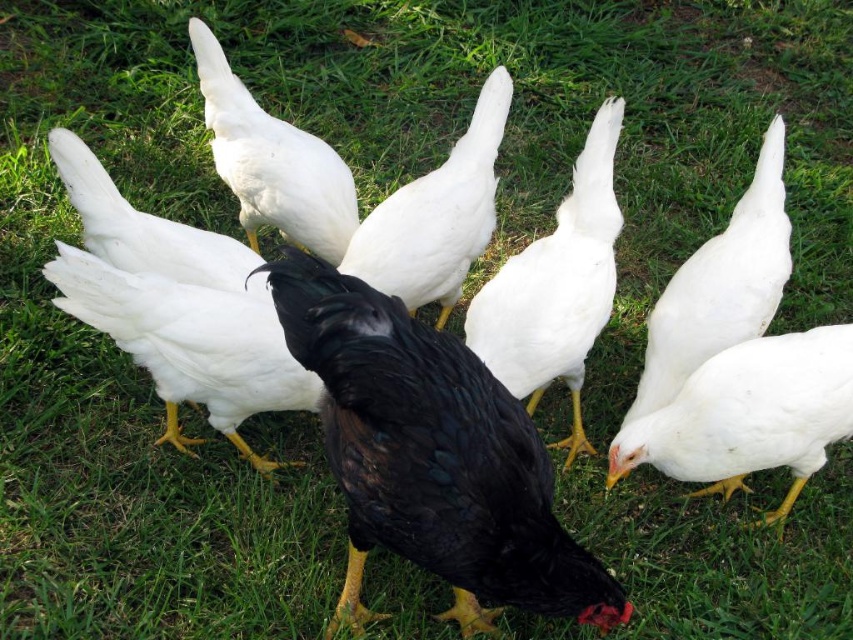
Question: Estimate the real-world distances between objects in this image. Which object is farther from the white matte feathers at right?

Choices:
 (A) white matte chicken at center
 (B) white matte chicken at upper left

Answer: (B)

Question: Is white matte feathers at right positioned at the back of white matte chicken at center?

Choices:
 (A) yes
 (B) no

Answer: (B)

Question: Is white matte chicken at center below white matte chicken at upper left?

Choices:
 (A) no
 (B) yes

Answer: (B)

Question: Estimate the real-world distances between objects in this image. Which object is farther from the black matte chicken at center?

Choices:
 (A) black glossy chicken at center
 (B) white matte feathers at right

Answer: (A)

Question: Is white matte chicken at lower right closer to camera compared to white matte chicken at upper left?

Choices:
 (A) no
 (B) yes

Answer: (B)

Question: Which object is closer to the camera taking this photo?

Choices:
 (A) white matte chicken at center
 (B) black glossy chicken at center
 (C) white matte chicken at upper left

Answer: (B)